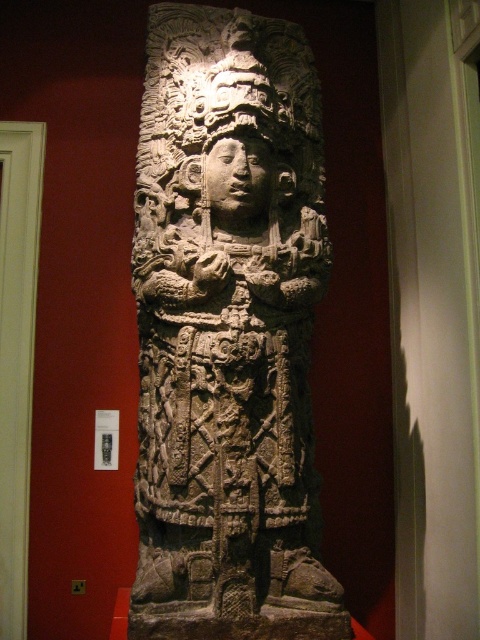
Is dark gray stone sculpture at center closer to camera compared to carved stone head at center?

That is True.

What do you see at coordinates (228, 332) in the screenshot? I see `dark gray stone sculpture at center` at bounding box center [228, 332].

Locate an element on the screen. Image resolution: width=480 pixels, height=640 pixels. dark gray stone sculpture at center is located at coordinates (228, 332).